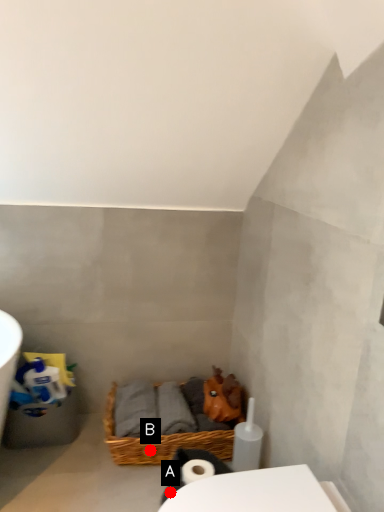
Question: Two points are circled on the image, labeled by A and B beside each circle. Which point is closer to the camera taking this photo?

Choices:
 (A) A is closer
 (B) B is closer

Answer: (A)